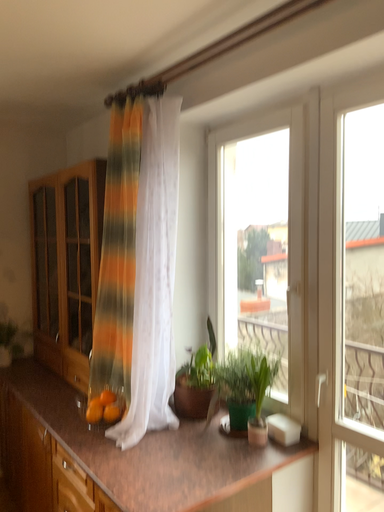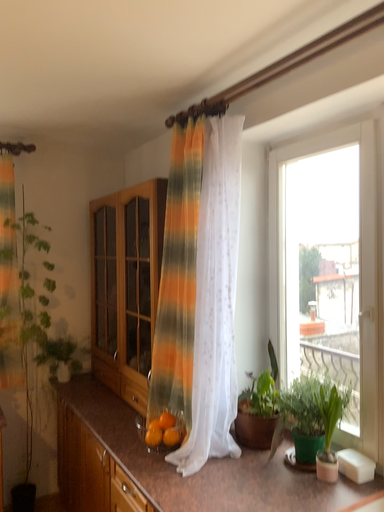
Question: Which way did the camera rotate in the video?

Choices:
 (A) rotated left
 (B) rotated right

Answer: (A)